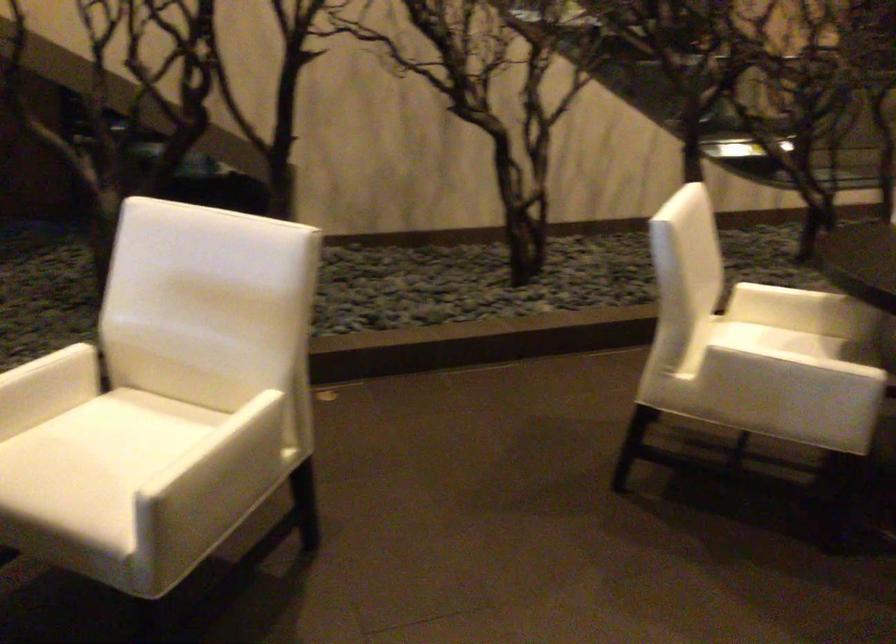
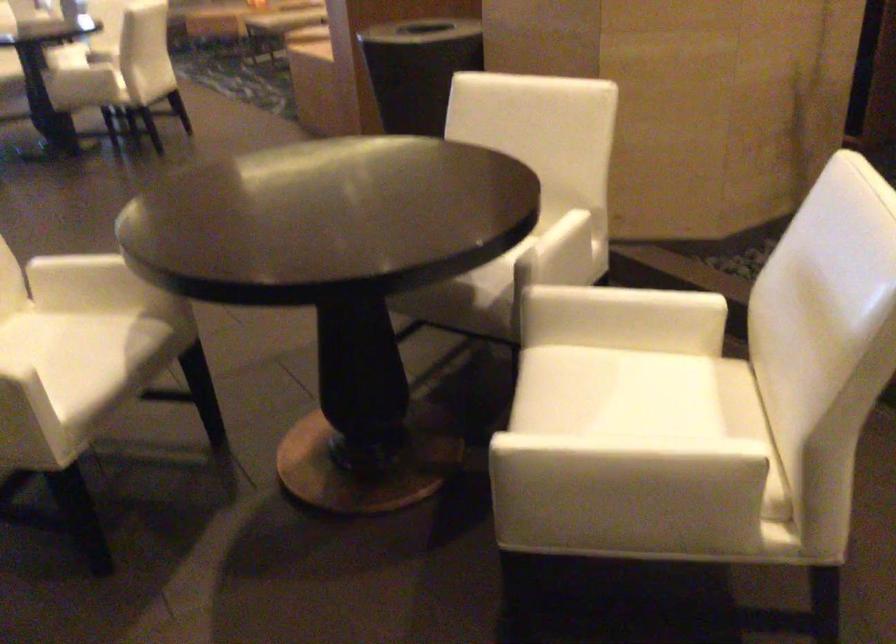
Locate, in the second image, the point that corresponds to the point at 106,440 in the first image.

(640, 393)